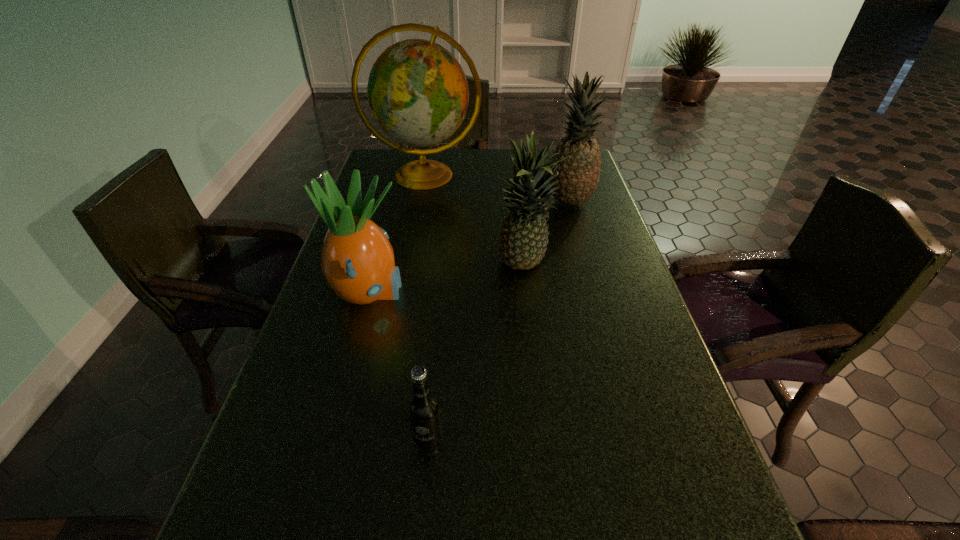
The image size is (960, 540). I want to click on vacant space at the right edge, so click(x=583, y=253).

In the image, there is a desktop. Where is `vacant space at the far left corner`? Image resolution: width=960 pixels, height=540 pixels. vacant space at the far left corner is located at coordinates point(417,148).

Where is `free space between the nearest object and the rightmost pineapple`? This screenshot has height=540, width=960. free space between the nearest object and the rightmost pineapple is located at coordinates (499, 321).

Locate an element on the screen. The image size is (960, 540). vacant space that's between the globe and the second shortest object is located at coordinates (396, 234).

Where is `vacant region between the shortest object and the fourth tallest object`? vacant region between the shortest object and the fourth tallest object is located at coordinates (398, 367).

Identify the location of object that ranks as the third closest to the second object from right to left. The width and height of the screenshot is (960, 540). (x=418, y=93).

Locate an element on the screen. This screenshot has width=960, height=540. object that can be found as the third closest to the nearest object is located at coordinates (578, 176).

Identify which pineapple is located as the third nearest to the root beer. Please provide its 2D coordinates. Your answer should be formatted as a tuple, i.e. [(x, y)], where the tuple contains the x and y coordinates of a point satisfying the conditions above.

[(578, 176)]

Choose which pineapple is the second nearest neighbor to the globe. Please provide its 2D coordinates. Your answer should be formatted as a tuple, i.e. [(x, y)], where the tuple contains the x and y coordinates of a point satisfying the conditions above.

[(523, 239)]